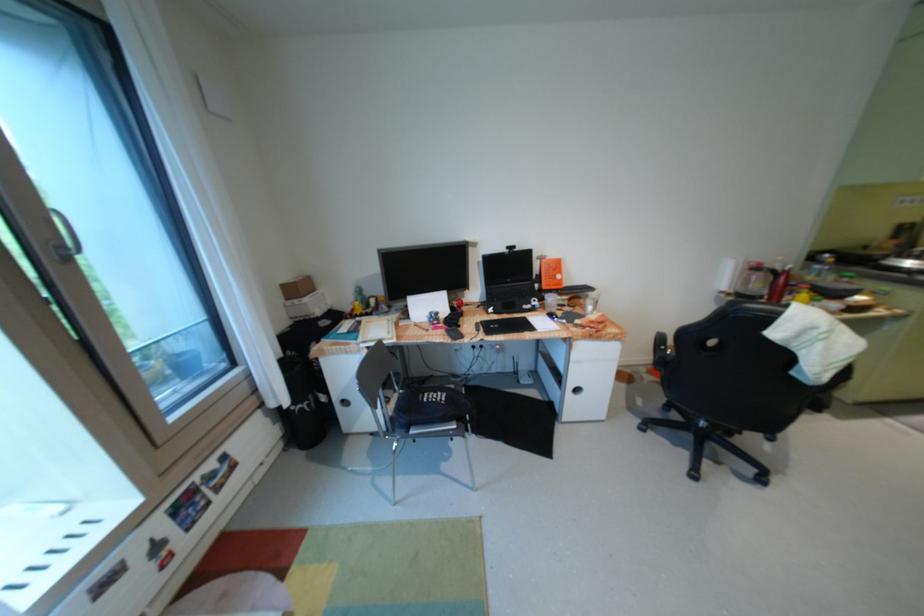
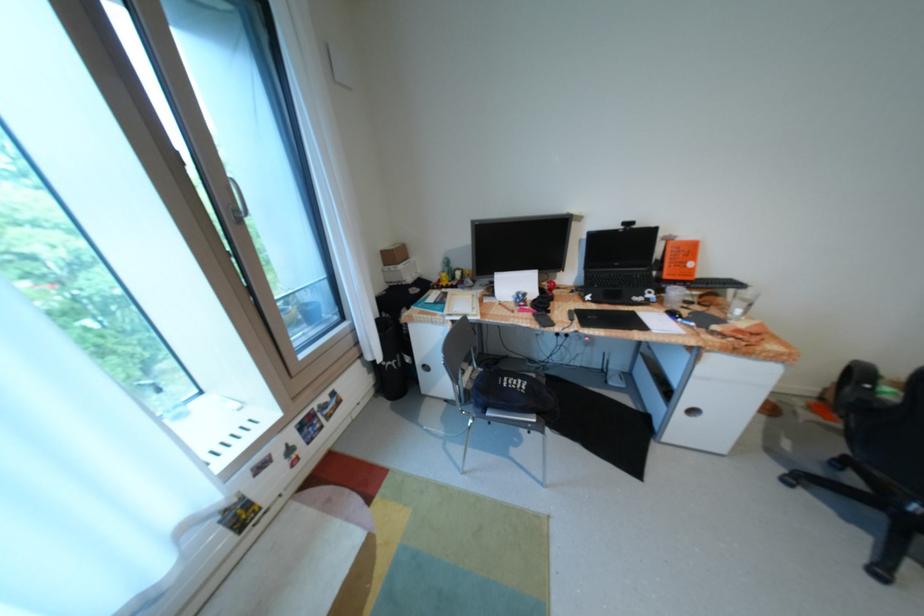
In the second image, find the point that corresponds to (x=591, y=302) in the first image.

(731, 301)